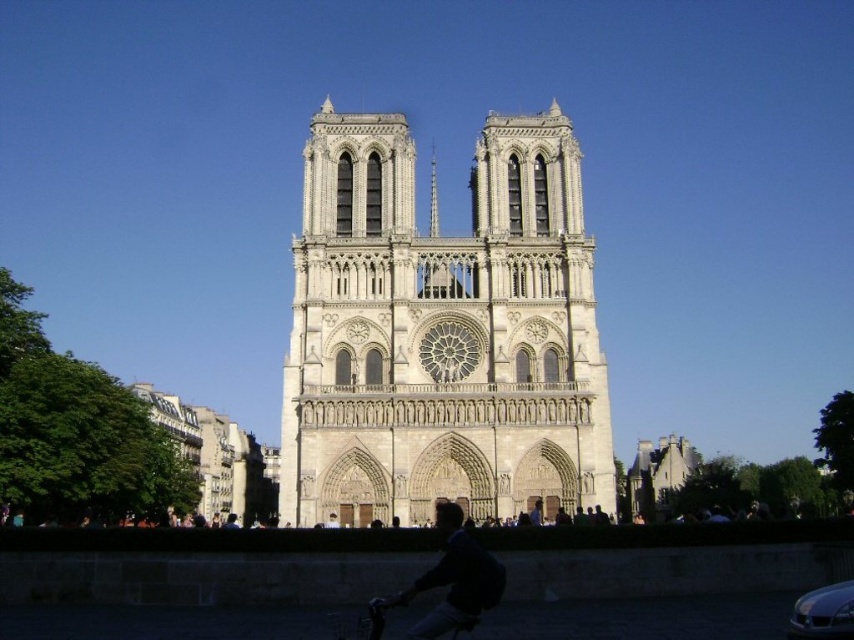
Which is below, dark blue sweater at lower center or smooth stone spire at center?

dark blue sweater at lower center is lower down.

Between point (455, 509) and point (431, 216), which one is positioned behind?

Positioned behind is point (431, 216).

Identify the location of dark blue sweater at lower center. This screenshot has width=854, height=640. (449, 580).

Which is in front, point (328, 488) or point (427, 573)?

Point (427, 573) is in front.

Where is `beige stone cathedral at center`? beige stone cathedral at center is located at coordinates (442, 332).

Does beige stone cathedral at center lie behind smooth stone spire at center?

No, beige stone cathedral at center is in front of smooth stone spire at center.

Can you confirm if beige stone cathedral at center is positioned above smooth stone spire at center?

No, beige stone cathedral at center is not above smooth stone spire at center.

Is point (519, 330) farther from viewer compared to point (436, 234)?

That is False.

Identify the location of beige stone cathedral at center. (442, 332).